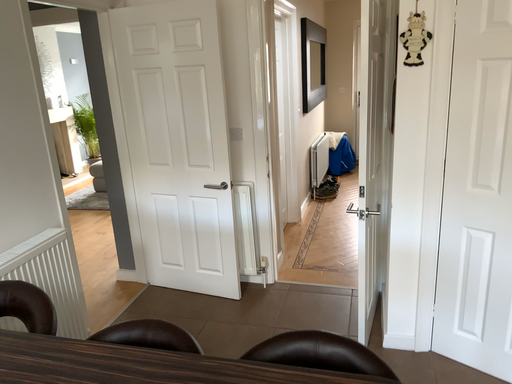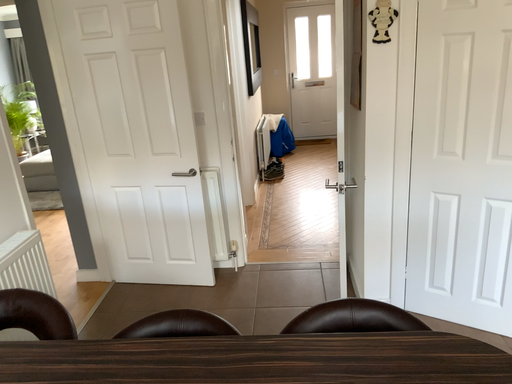
Question: Which way did the camera rotate in the video?

Choices:
 (A) rotated left
 (B) rotated right

Answer: (B)